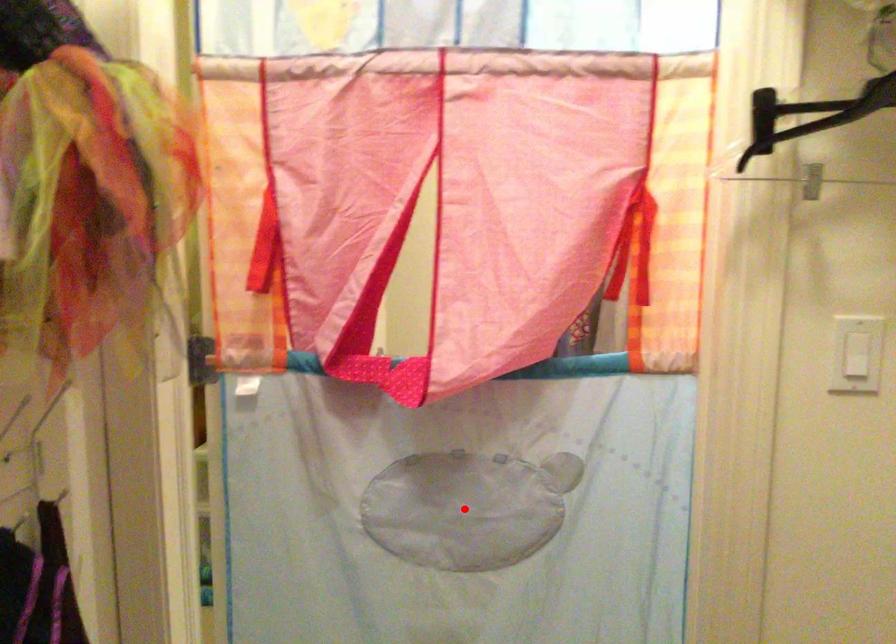
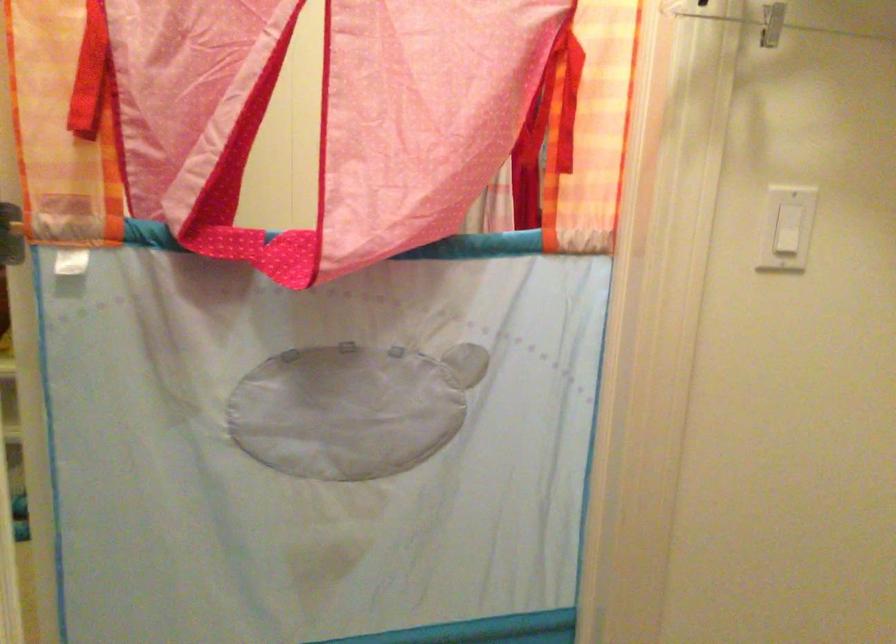
The point at the highlighted location is marked in the first image. Where is the corresponding point in the second image?

(351, 408)